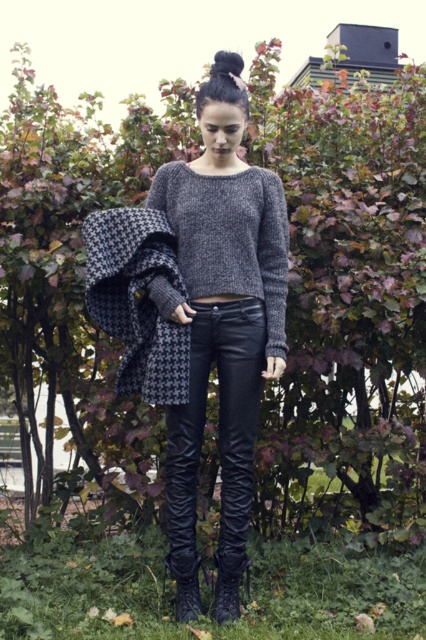
Can you confirm if knitted gray sweater at center is smaller than houndstooth wool shawl at left?

Actually, knitted gray sweater at center might be larger than houndstooth wool shawl at left.

Does knitted gray sweater at center appear under houndstooth wool shawl at left?

No.

Where is `knitted gray sweater at center`? Image resolution: width=426 pixels, height=640 pixels. knitted gray sweater at center is located at coordinates (229, 236).

Does knit sweater at center appear over houndstooth wool shawl at left?

Incorrect, knit sweater at center is not positioned above houndstooth wool shawl at left.

How far apart are knit sweater at center and houndstooth wool shawl at left?

They are 8.50 inches apart.

Which is behind, point (226, 612) or point (150, 268)?

The point (150, 268) is more distant.

This screenshot has height=640, width=426. Find the location of `knit sweater at center`. knit sweater at center is located at coordinates (221, 324).

Does point (218, 244) come in front of point (169, 182)?

Yes.

Does knit sweater at center have a greater height compared to knitted gray sweater at center?

Yes.

Find the location of a particular element. Image resolution: width=426 pixels, height=640 pixels. knit sweater at center is located at coordinates (221, 324).